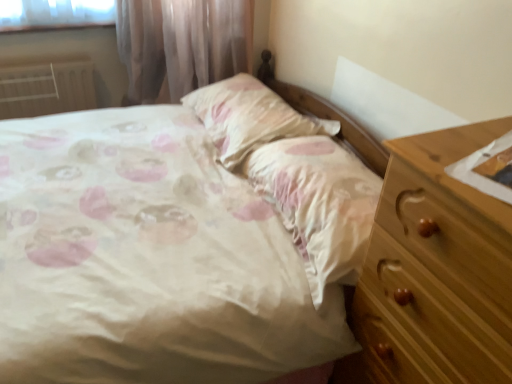
Question: Can you confirm if white painted metal radiator at left is wider than satin floral pillow at center?

Choices:
 (A) yes
 (B) no

Answer: (B)

Question: Is white painted metal radiator at left taller than satin floral pillow at center?

Choices:
 (A) yes
 (B) no

Answer: (A)

Question: Considering the relative sizes of white painted metal radiator at left and satin floral pillow at center in the image provided, is white painted metal radiator at left bigger than satin floral pillow at center?

Choices:
 (A) yes
 (B) no

Answer: (B)

Question: Is white painted metal radiator at left facing away from satin floral pillow at center?

Choices:
 (A) yes
 (B) no

Answer: (B)

Question: Is white painted metal radiator at left smaller than satin floral pillow at center?

Choices:
 (A) no
 (B) yes

Answer: (B)

Question: Is satin floral pillow at center taller or shorter than white painted metal radiator at left?

Choices:
 (A) tall
 (B) short

Answer: (B)

Question: From the image's perspective, is satin floral pillow at center above or below white painted metal radiator at left?

Choices:
 (A) above
 (B) below

Answer: (B)

Question: From a real-world perspective, is satin floral pillow at center physically located above or below white painted metal radiator at left?

Choices:
 (A) below
 (B) above

Answer: (B)

Question: Is point (206, 117) closer or farther from the camera than point (45, 74)?

Choices:
 (A) farther
 (B) closer

Answer: (B)

Question: In terms of size, does satin floral pillow at center appear bigger or smaller than pink satin sheet at center?

Choices:
 (A) big
 (B) small

Answer: (B)

Question: Relative to pink satin sheet at center, is satin floral pillow at center in front or behind?

Choices:
 (A) front
 (B) behind

Answer: (B)

Question: Based on their positions, is satin floral pillow at center located to the left or right of pink satin sheet at center?

Choices:
 (A) left
 (B) right

Answer: (A)

Question: In terms of height, does satin floral pillow at center look taller or shorter compared to pink satin sheet at center?

Choices:
 (A) short
 (B) tall

Answer: (A)

Question: Would you say white painted metal radiator at left is to the left or to the right of pink satin sheet at center in the picture?

Choices:
 (A) right
 (B) left

Answer: (B)

Question: From their relative heights in the image, would you say white painted metal radiator at left is taller or shorter than pink satin sheet at center?

Choices:
 (A) tall
 (B) short

Answer: (A)